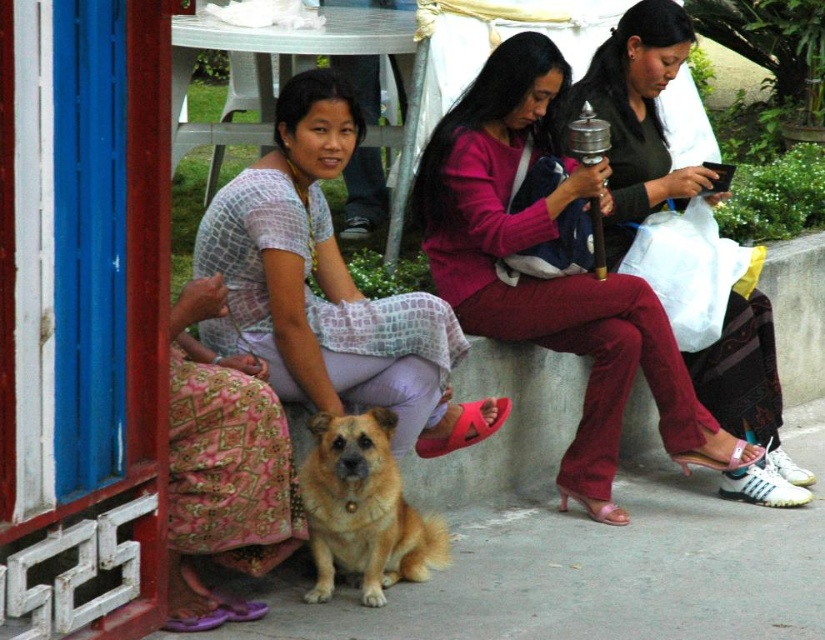
Can you confirm if matte white dress at center is taller than golden fur dog at center?

Correct, matte white dress at center is much taller as golden fur dog at center.

Which of these two, matte white dress at center or golden fur dog at center, stands taller?

Standing taller between the two is matte white dress at center.

Is point (314, 259) positioned before point (319, 493)?

No, (314, 259) is further to viewer.

This screenshot has height=640, width=825. Identify the location of matte white dress at center. (328, 285).

Which is more to the left, matte pink sweater at center or matte white dress at center?

From the viewer's perspective, matte white dress at center appears more on the left side.

You are a GUI agent. You are given a task and a screenshot of the screen. Output one action in this format:
    pyautogui.click(x=<x>, y=<y>)
    Task: Click on the matte pink sweater at center
    This screenshot has width=825, height=640.
    Given the screenshot: What is the action you would take?
    pyautogui.click(x=552, y=278)

At what (x,y) coordinates should I click in order to perform the action: click on matte pink sweater at center. Please return your answer as a coordinate pair (x, y). The height and width of the screenshot is (640, 825). Looking at the image, I should click on (552, 278).

Between matte pink sweater at center and golden fur dog at center, which one is positioned lower?

golden fur dog at center

This screenshot has width=825, height=640. In order to click on matte pink sweater at center in this screenshot , I will do `click(552, 278)`.

Find the location of a particular element. Image resolution: width=825 pixels, height=640 pixels. matte pink sweater at center is located at coordinates (552, 278).